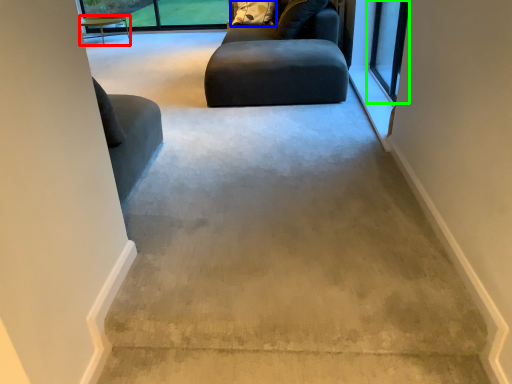
Question: Which object is the farthest from table (highlighted by a red box)? Choose among these: pillow (highlighted by a blue box) or window (highlighted by a green box).

Choices:
 (A) pillow
 (B) window

Answer: (B)